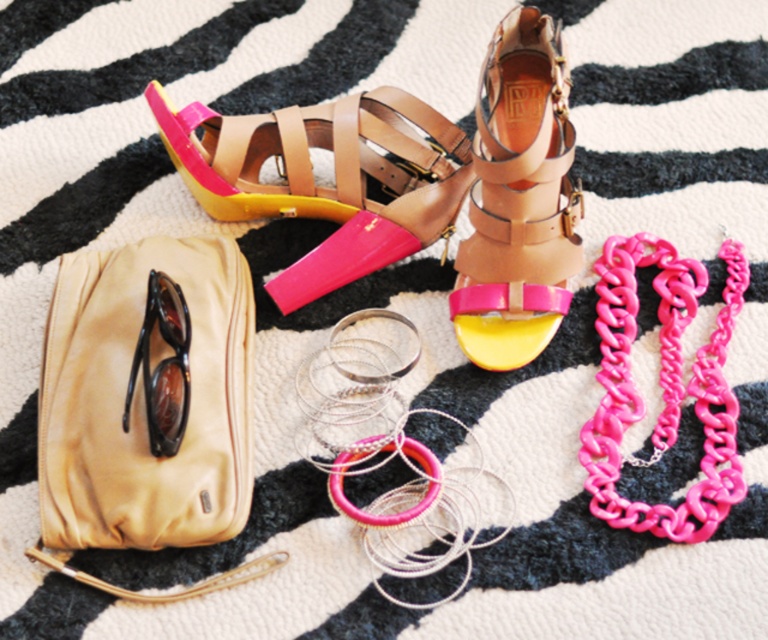
Consider the image. Which of these two, tan leather sandal at center or black shiny sunglasses at left, stands taller?

tan leather sandal at center is taller.

Can you confirm if tan leather sandal at center is taller than black shiny sunglasses at left?

Yes, tan leather sandal at center is taller than black shiny sunglasses at left.

Does point (511, 227) come closer to viewer compared to point (177, 397)?

That is False.

The image size is (768, 640). Identify the location of tan leather sandal at center. (518, 198).

Does pink matte leather sandal at center have a greater height compared to black shiny sunglasses at left?

Indeed, pink matte leather sandal at center has a greater height compared to black shiny sunglasses at left.

Can you confirm if pink matte leather sandal at center is positioned to the right of black shiny sunglasses at left?

Indeed, pink matte leather sandal at center is positioned on the right side of black shiny sunglasses at left.

Where is `pink matte leather sandal at center`? pink matte leather sandal at center is located at coordinates (333, 177).

Between point (151, 108) and point (482, 179), which one is positioned behind?

The point (151, 108) is behind.

Does pink matte leather sandal at center have a smaller size compared to tan leather sandal at center?

No.

Where is `pink matte leather sandal at center`? The image size is (768, 640). pink matte leather sandal at center is located at coordinates (333, 177).

Locate an element on the screen. pink matte leather sandal at center is located at coordinates (333, 177).